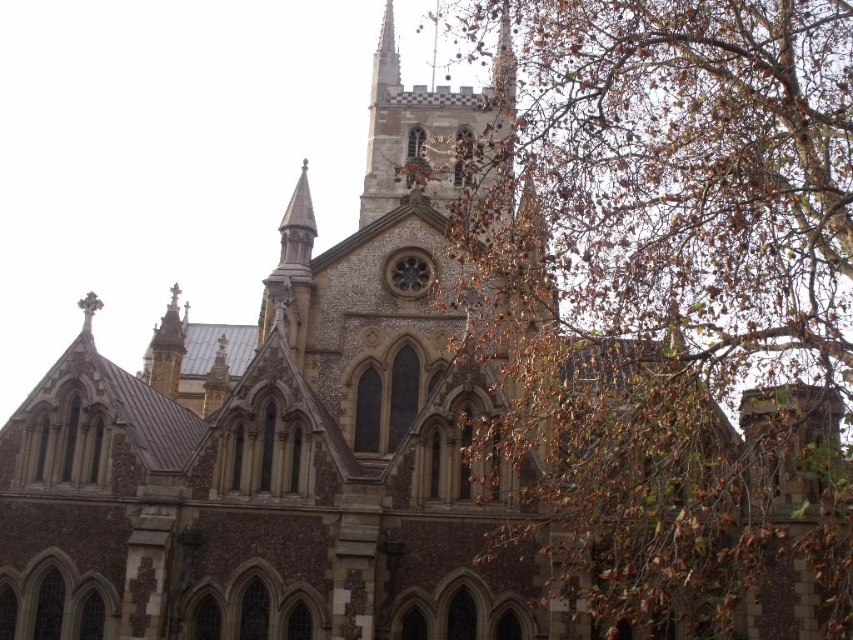
Question: Does brown leafy branches at upper right appear over brown stone clock tower at center?

Choices:
 (A) no
 (B) yes

Answer: (A)

Question: Is brown leafy branches at upper right wider than brown stone clock tower at center?

Choices:
 (A) no
 (B) yes

Answer: (B)

Question: Which of the following is the farthest from the observer?

Choices:
 (A) (378, 132)
 (B) (509, 131)

Answer: (A)

Question: Can you confirm if brown leafy branches at upper right is thinner than brown stone clock tower at center?

Choices:
 (A) yes
 (B) no

Answer: (B)